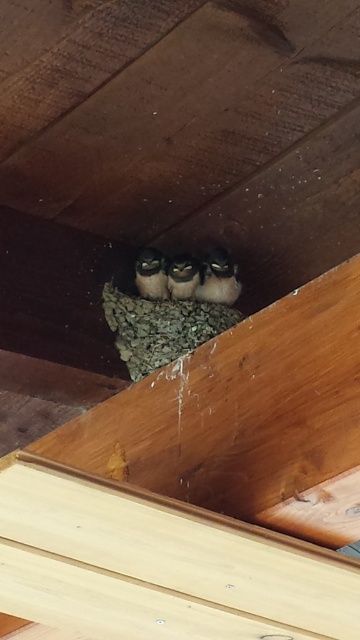
You are a wildlife photographer aiming to capture a closeup shot of the brown fuzzy owl at center without disturbing the gray mud nest at center. Given that your camera lens has a minimum focusing distance of 10 inches, can you safely take the photo from your current position?

The distance between the gray mud nest at center and the brown fuzzy owl at center is 9.44 inches. Since your camera lens requires a minimum of 10 inches to focus, you are too close to capture a clear photo. Move back slightly to ensure the distance meets or exceeds 10 inches.

You are a wildlife photographer aiming to capture a closeup of the gray mud nest at center. Given that your camera has a focal length of 100mm and you are positioned 2 meters away from the nest, can you estimate the approximate size of the nest in the camera frame?

The gray mud nest at center is positioned at point coordinates, but without specific size data, the exact size in the camera frame cannot be determined. However, using the camera settings provided, you can calculate the field of view and estimate the nest size based on its distance and focal length.

You are a wildlife photographer aiming to capture a closeup of the brown fuzzy bird at center. Based on the scene description, can you determine if the bird is positioned closer to the front or the back of the nest?

The brown fuzzy bird at center is located at point coordinates that are not directly indicative of front or back positioning without additional spatial context from the scene. However, since the nest is situated within a triangular alcove formed by two sloped wooden beams, and the bird is at the center, it is likely positioned towards the middle depth of the nest, neither front nor back.